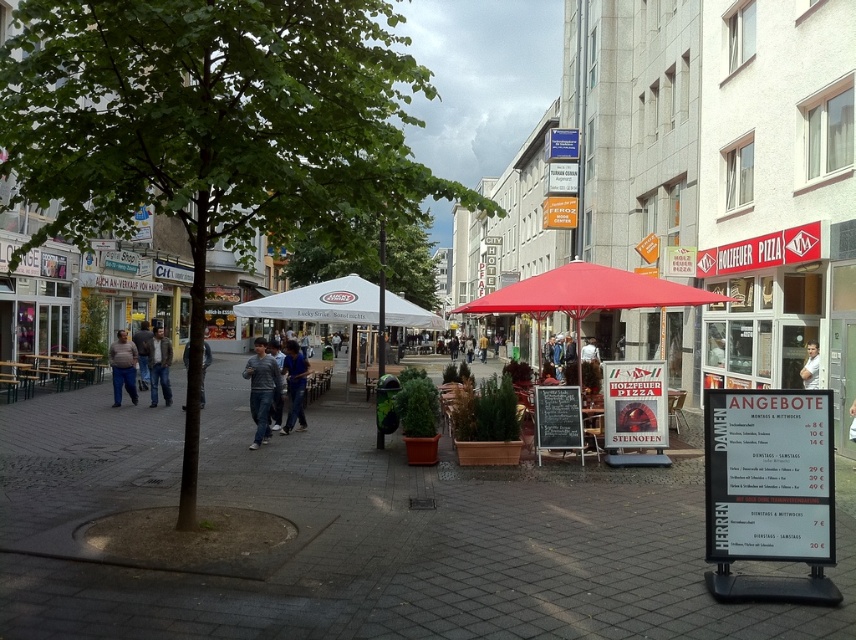
You are standing at the center of the street and want to walk towards the two points marked in the image. Which point, point (x=800, y=628) or point (x=551, y=296), will you reach first?

Point (x=800, y=628) is closer to the viewer than point (x=551, y=296), so you will reach point (x=800, y=628) first.

You are a delivery person holding a package that needs to be placed exactly between the dark gray sweater at center and the denim jeans at center. The package is 3.5 feet long. Can you fit it between them without overlapping either item?

The distance between the dark gray sweater at center and denim jeans at center is 7.03 feet. Since the package is 3.5 feet long, which is less than half of the total distance between them, there is enough space to place it in the middle without overlapping either item.